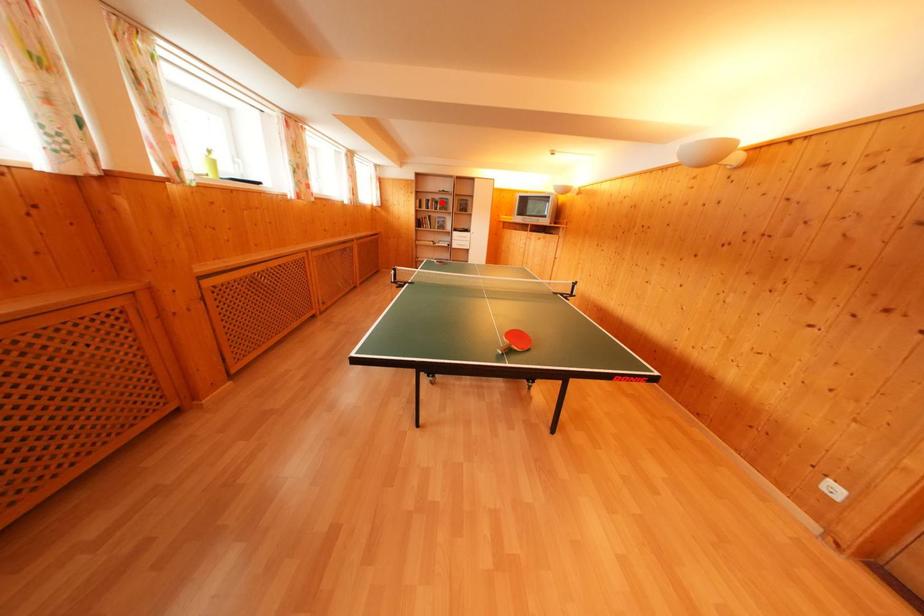
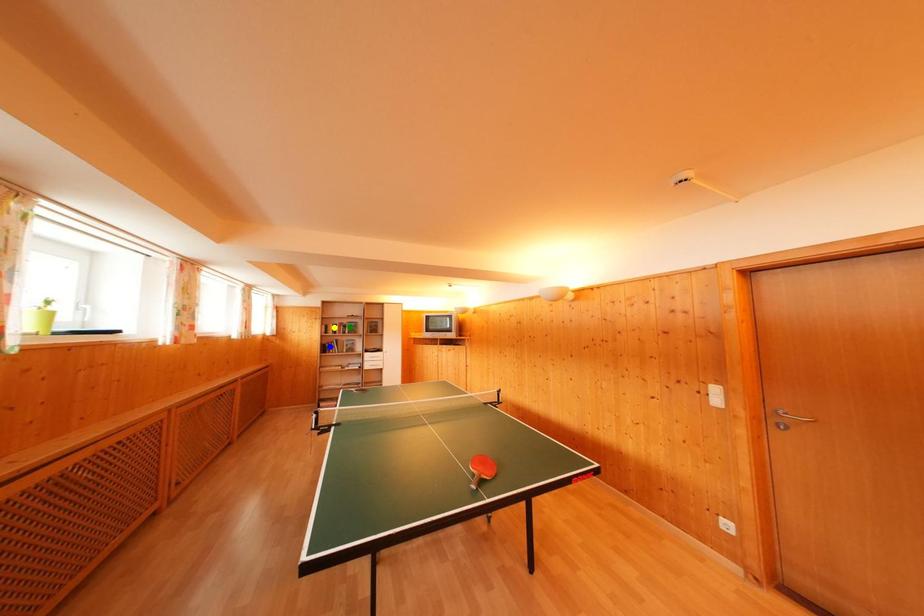
Question: I am providing you with two images of the same scene from different viewpoints. A red point is marked on the first image. You are given multiple points on the second image. In image 2, which mark is for the same physical point as the one in image 1?

Choices:
 (A) yellow point
 (B) blue point
 (C) green point

Answer: (C)